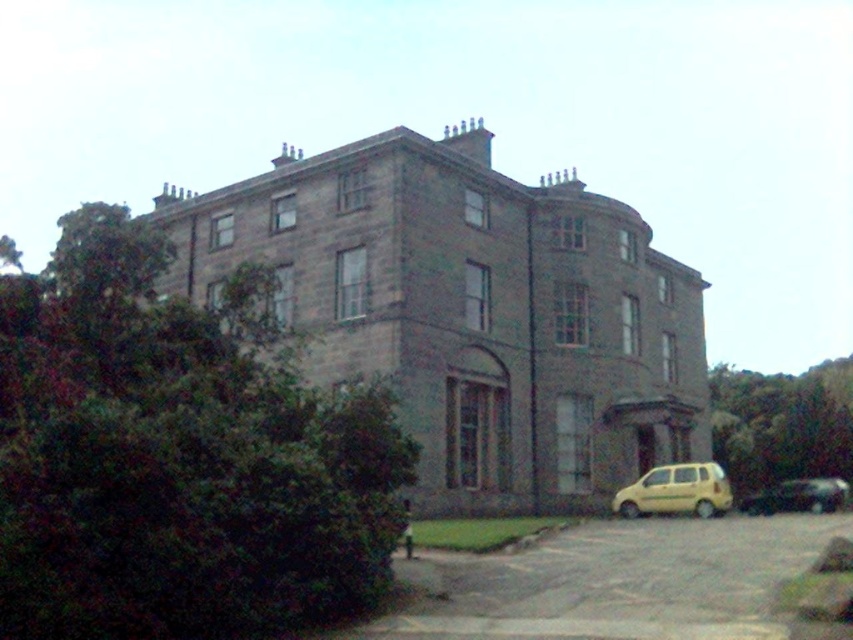
Is yellow matte van at lower right taller than shiny black car at lower right?

In fact, yellow matte van at lower right may be shorter than shiny black car at lower right.

Between yellow matte van at lower right and shiny black car at lower right, which one appears on the left side from the viewer's perspective?

yellow matte van at lower right

This screenshot has width=853, height=640. I want to click on yellow matte van at lower right, so click(676, 492).